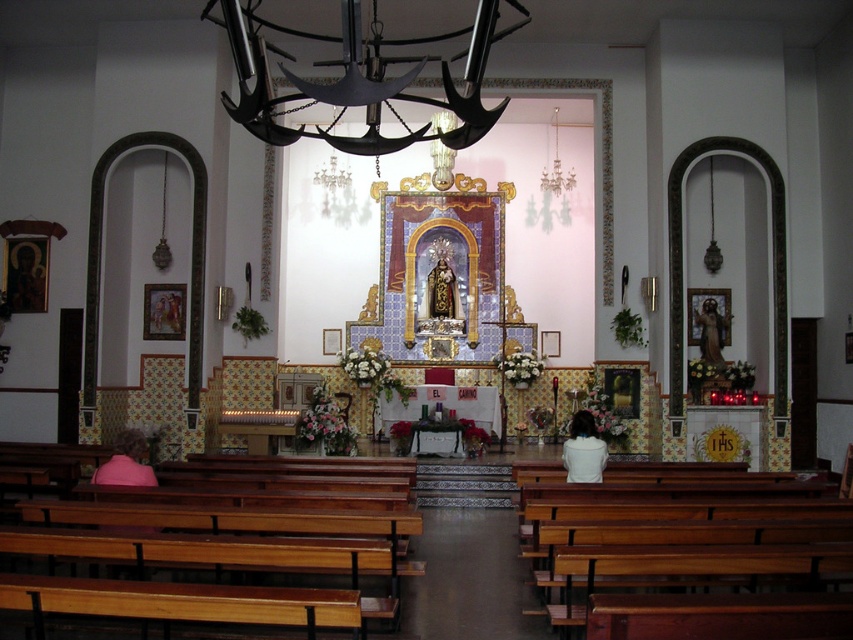
Who is more forward, (91, 476) or (718, 337)?

Point (91, 476) is in front.

Is point (126, 460) closer to viewer compared to point (708, 326)?

Yes, it is.

Where is `pink fabric at lower left`? pink fabric at lower left is located at coordinates (125, 461).

Can you confirm if white fabric at center is positioned below wooden statue at right?

Yes.

Who is lower down, white fabric at center or wooden statue at right?

white fabric at center

Describe the element at coordinates (583, 449) in the screenshot. Image resolution: width=853 pixels, height=640 pixels. I see `white fabric at center` at that location.

You are a GUI agent. You are given a task and a screenshot of the screen. Output one action in this format:
    pyautogui.click(x=<x>, y=<y>)
    Task: Click on the white fabric at center
    
    Given the screenshot: What is the action you would take?
    pyautogui.click(x=583, y=449)

Which is behind, point (585, 474) or point (109, 472)?

Positioned behind is point (585, 474).

Describe the element at coordinates (583, 449) in the screenshot. The width and height of the screenshot is (853, 640). I see `white fabric at center` at that location.

Locate an element on the screen. white fabric at center is located at coordinates (583, 449).

Find the location of `white fabric at center`. white fabric at center is located at coordinates (583, 449).